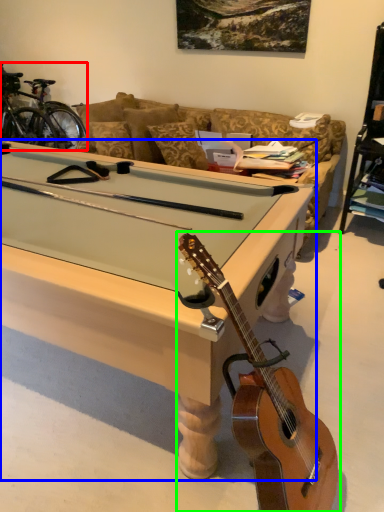
Question: Based on their relative distances, which object is nearer to bicycle (highlighted by a red box)? Choose from desk (highlighted by a blue box) and guitar (highlighted by a green box).

Choices:
 (A) desk
 (B) guitar

Answer: (A)